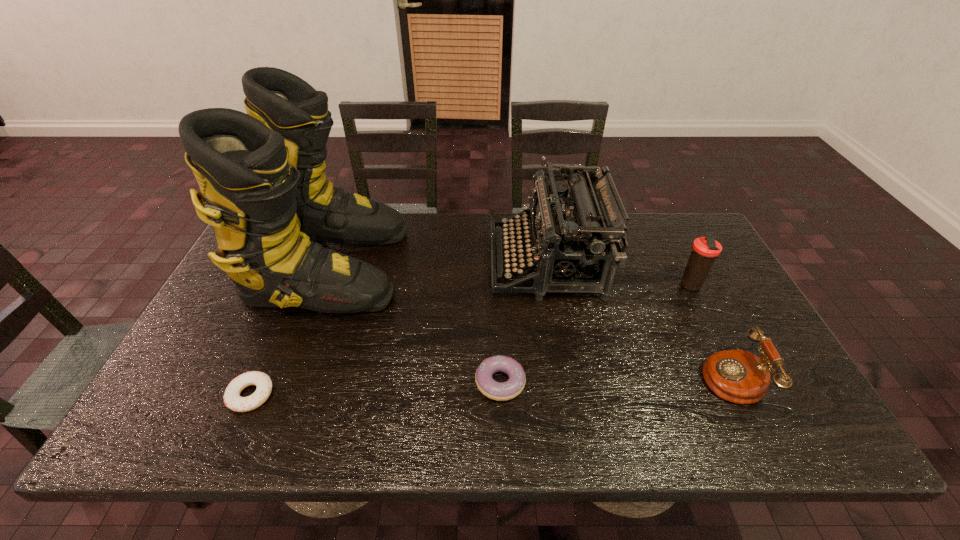
I want to click on telephone present at the near edge, so click(x=738, y=376).

Identify the location of doughnut located at the near edge. The image size is (960, 540). (232, 399).

Where is `ski boots located at the left edge`? ski boots located at the left edge is located at coordinates (x=262, y=177).

Where is `doughnut positioned at the left edge`? This screenshot has height=540, width=960. doughnut positioned at the left edge is located at coordinates (232, 399).

In order to click on thermos bottle that is at the right edge in this screenshot , I will do `click(705, 250)`.

I want to click on telephone that is at the right edge, so click(738, 376).

Locate an element on the screen. The image size is (960, 540). object present at the far left corner is located at coordinates (262, 177).

Identify the location of object situated at the near left corner. This screenshot has width=960, height=540. (232, 399).

Locate an element on the screen. object that is positioned at the near right corner is located at coordinates (738, 376).

Where is `vacant space at the far edge`? The height and width of the screenshot is (540, 960). vacant space at the far edge is located at coordinates (632, 232).